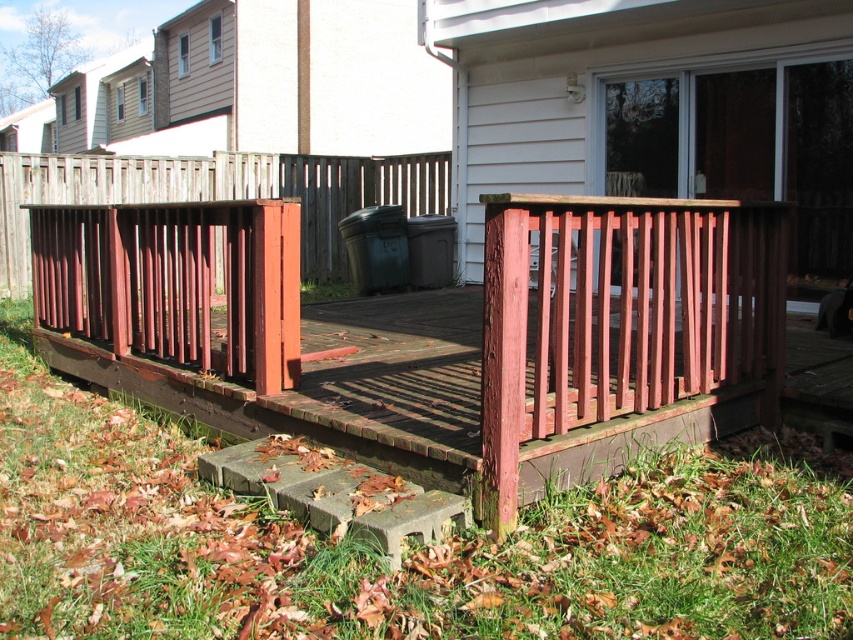
Question: Which object is farther from the camera taking this photo?

Choices:
 (A) wooden slats at lower right
 (B) rustic wood railing at center

Answer: (B)

Question: In this image, where is rustic wood fence at center located relative to gray concrete step at lower left?

Choices:
 (A) above
 (B) below

Answer: (A)

Question: Which point is farther to the camera?

Choices:
 (A) (234, 273)
 (B) (229, 176)
 (C) (737, 300)
 (D) (338, 525)

Answer: (B)

Question: Can you confirm if wooden porch at center is smaller than wooden slats at lower right?

Choices:
 (A) no
 (B) yes

Answer: (A)

Question: Is rustic wood fence at center below gray concrete step at lower left?

Choices:
 (A) yes
 (B) no

Answer: (B)

Question: Based on their relative distances, which object is farther from the wooden slats at lower right?

Choices:
 (A) gray concrete step at lower left
 (B) rustic wood railing at center
 (C) rustic wood fence at center

Answer: (C)